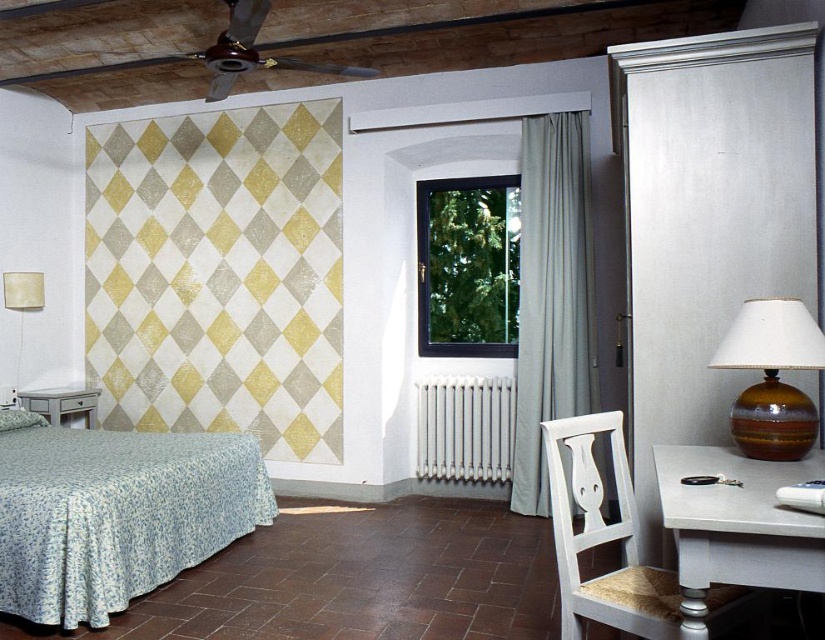
You are trying to decide whether to place a tall vase on the white glossy nightstand at lower left. Considering the height of the matte cream lampshade at left, do you think the vase will be stable on the nightstand?

The white glossy nightstand at lower left is not as tall as the matte cream lampshade at left, so the vase might be less stable on the nightstand because it is shorter than the lampshade.

You are organizing a small party in the bedroom and need to place a decorative item between the white glossy nightstand at lower left and the matte cream lampshade at left. Based on their positions, where should you place the item?

The white glossy nightstand at lower left is to the right of the matte cream lampshade at left, so you should place the decorative item between them, closer to the left side near the matte cream lampshade at left since it is positioned further left than the nightstand.

You are standing in the bedroom and need to place a small plant on the white glossy table at lower right. Based on the room layout described, where exactly should you position the plant to ensure it sits on the table?

The white glossy table at lower right is located at point [736,525], so place the plant at that coordinate to ensure it sits on the table.